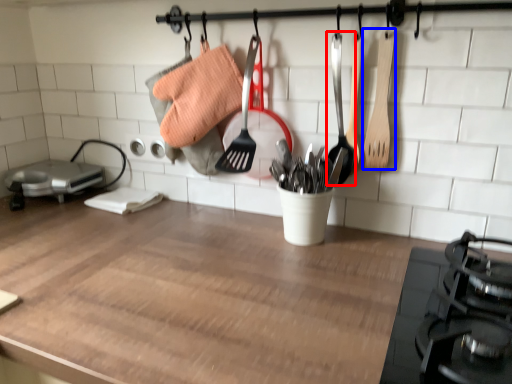
Question: Among these objects, which one is nearest to the camera, utensil (highlighted by a red box) or spatula (highlighted by a blue box)?

Choices:
 (A) utensil
 (B) spatula

Answer: (B)